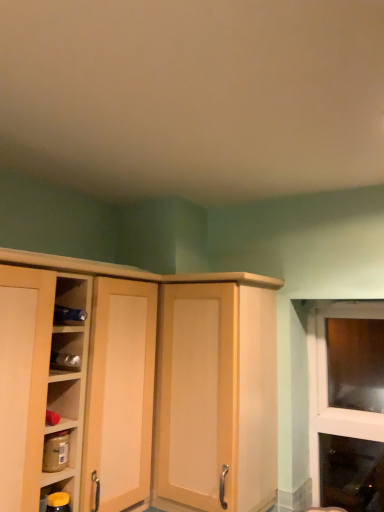
Question: Is yellow matte jar at lower left, the second shelf positioned from the top, further to the viewer compared to matte wood cabinet at center?

Choices:
 (A) yes
 (B) no

Answer: (B)

Question: Does yellow matte jar at lower left, the second shelf positioned from the top, have a greater height compared to matte wood cabinet at center?

Choices:
 (A) yes
 (B) no

Answer: (B)

Question: From a real-world perspective, is yellow matte jar at lower left, the first shelf when ordered from bottom to top, positioned under matte wood cabinet at center based on gravity?

Choices:
 (A) no
 (B) yes

Answer: (B)

Question: Does yellow matte jar at lower left, the first shelf when ordered from bottom to top, have a smaller size compared to matte wood cabinet at center?

Choices:
 (A) no
 (B) yes

Answer: (B)

Question: Is yellow matte jar at lower left, the second shelf positioned from the top, far from matte wood cabinet at center?

Choices:
 (A) no
 (B) yes

Answer: (A)

Question: From the image's perspective, does yellow matte jar at lower left, the first shelf when ordered from bottom to top, appear lower than matte wood cabinet at center?

Choices:
 (A) no
 (B) yes

Answer: (B)

Question: Would you say matte wood cupboard at left is a long distance from matte wood cabinet at center?

Choices:
 (A) no
 (B) yes

Answer: (A)

Question: Considering the relative sizes of matte wood cupboard at left and matte wood cabinet at center in the image provided, is matte wood cupboard at left smaller than matte wood cabinet at center?

Choices:
 (A) no
 (B) yes

Answer: (A)

Question: Is matte wood cupboard at left not within matte wood cabinet at center?

Choices:
 (A) yes
 (B) no

Answer: (A)

Question: Considering the relative sizes of matte wood cupboard at left and matte wood cabinet at center in the image provided, is matte wood cupboard at left bigger than matte wood cabinet at center?

Choices:
 (A) yes
 (B) no

Answer: (A)

Question: Can you confirm if matte wood cupboard at left is shorter than matte wood cabinet at center?

Choices:
 (A) no
 (B) yes

Answer: (A)

Question: Is matte wood cupboard at left wider than matte wood cabinet at center?

Choices:
 (A) no
 (B) yes

Answer: (B)

Question: Does matte brown jar at lower left, arranged as the 1th shelf when viewed from the top, have a lesser width compared to yellow matte jar at lower left, the first shelf when ordered from bottom to top?

Choices:
 (A) no
 (B) yes

Answer: (A)